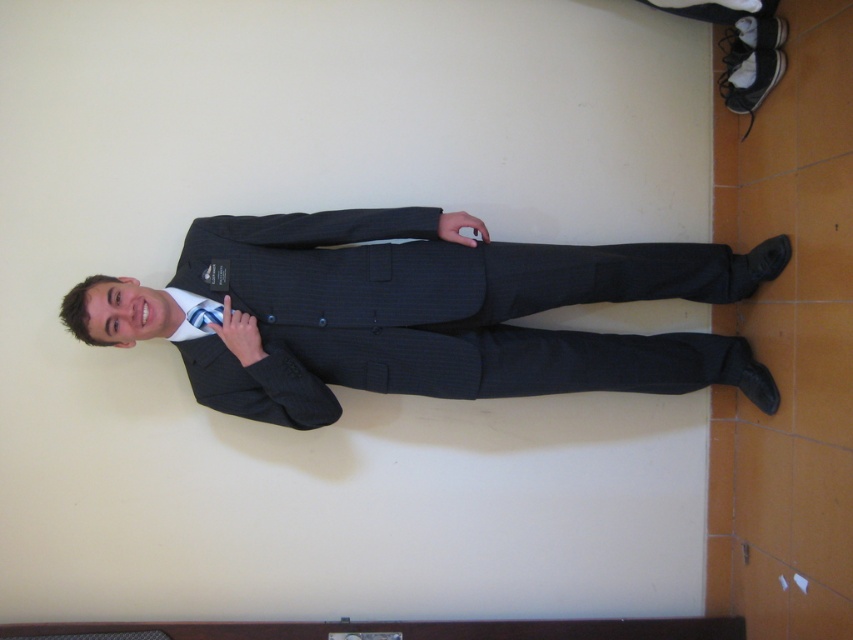
You are a tailor who needs to adjust the pinstriped fabric business suit at center and the silky blue tie at center. If you want to make them the same size, which one should you increase in size?

The silky blue tie at center should be increased in size because the pinstriped fabric business suit at center is currently larger than the silky blue tie at center.

Based on the scene description, where is the pinstriped fabric business suit at center located in terms of its 2D coordinates?

The pinstriped fabric business suit at center is located at the 2D coordinates point (x=434, y=314).